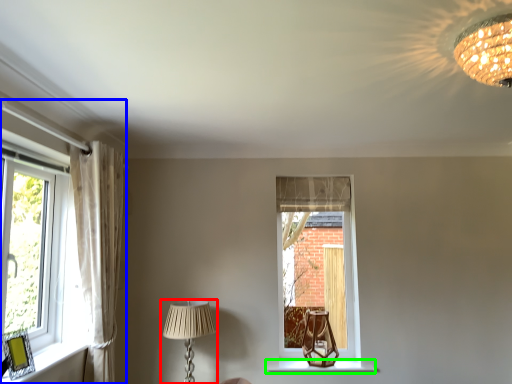
Question: Which object is positioned closest to lamp (highlighted by a red box)? Select from window (highlighted by a blue box) and window sill (highlighted by a green box).

Choices:
 (A) window
 (B) window sill

Answer: (A)